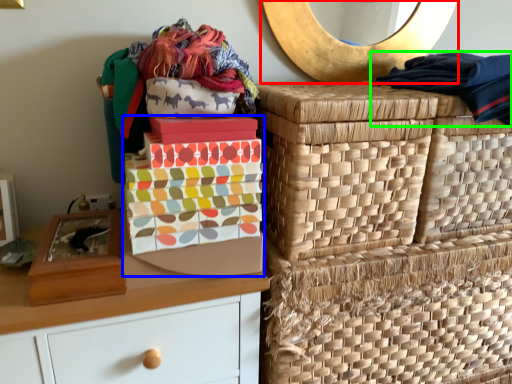
Question: Which is farther away from mirror (highlighted by a red box)? shoe box (highlighted by a blue box) or clothing (highlighted by a green box)?

Choices:
 (A) shoe box
 (B) clothing

Answer: (A)